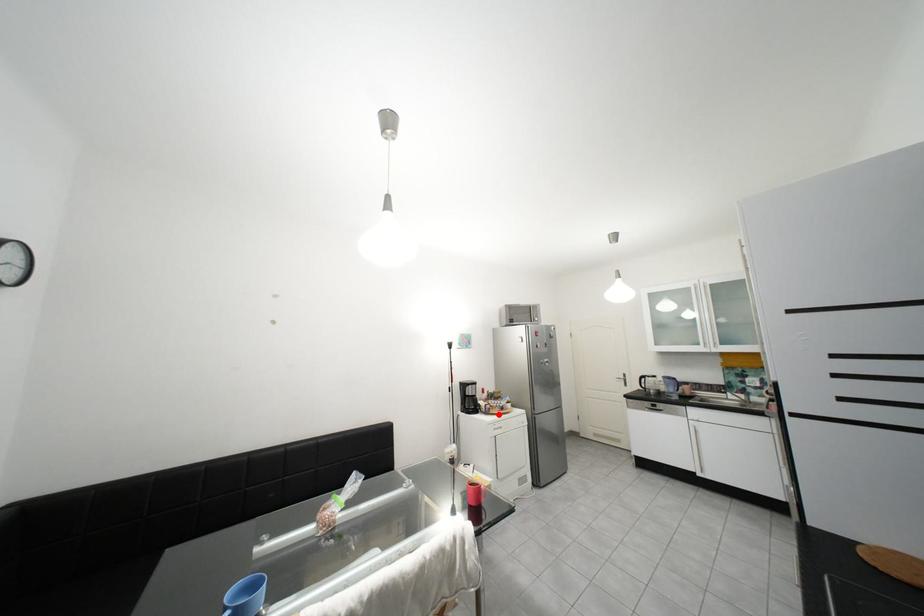
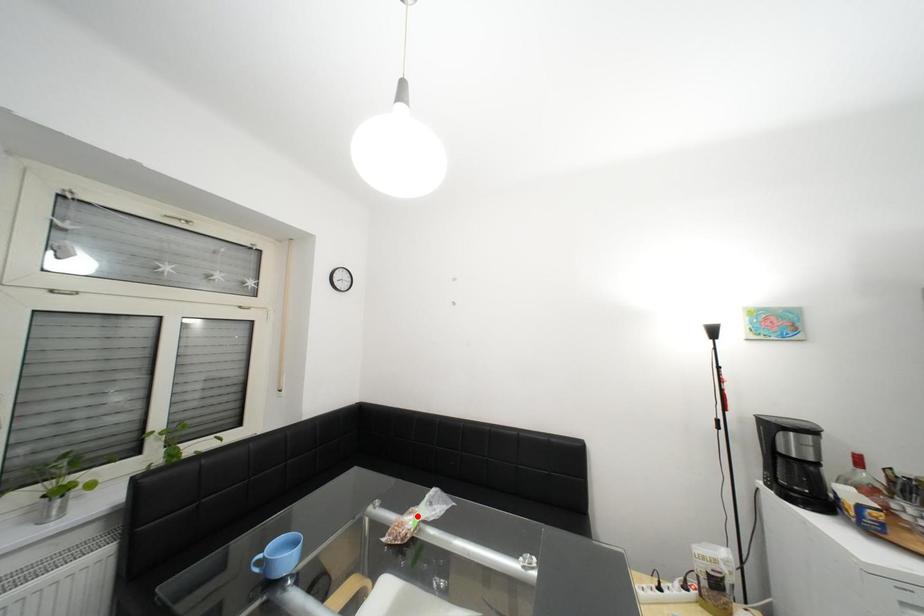
I am providing you with two images of the same scene from different viewpoints. A red point is marked on the first image and another point is marked on the second image. Do the highlighted points in image1 and image2 indicate the same real-world spot?

No